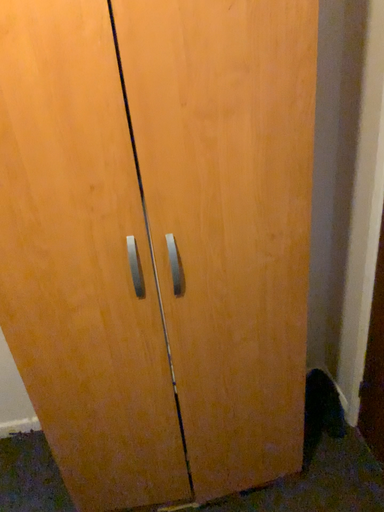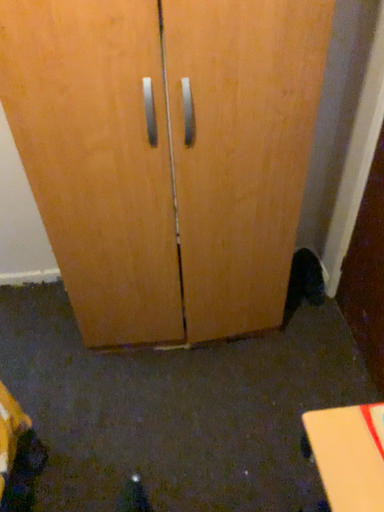
Question: Which way did the camera rotate in the video?

Choices:
 (A) rotated downward
 (B) rotated upward

Answer: (A)